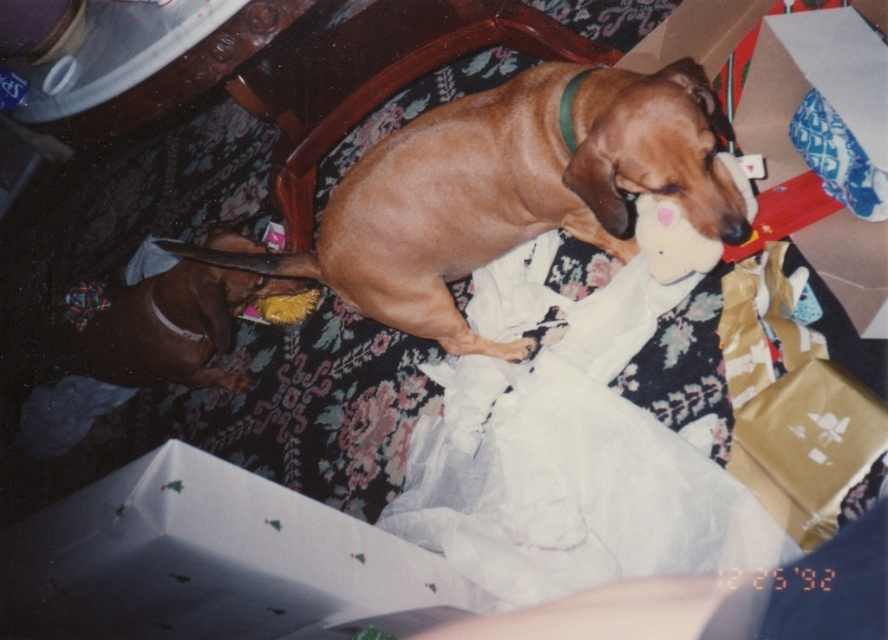
Based on the photo, you are trying to decide whether to place a new small plant pot on the table next to the gold cardboard box at upper right and the white plush toy at upper center. Based on their heights, which object should you place the plant pot next to to ensure it doesn not block the view of the taller one?

The gold cardboard box at upper right is much taller than the white plush toy at upper center. To ensure the plant pot doesn not block the view of the taller object, you should place it next to the white plush toy at upper center.

You are a photographer trying to capture a clear photo of the brown smooth dog at center and the brown matte dog at lower left. Which dog will appear closer to the camera in the photo?

The brown smooth dog at center will appear closer to the camera because it is in front of the brown matte dog at lower left.